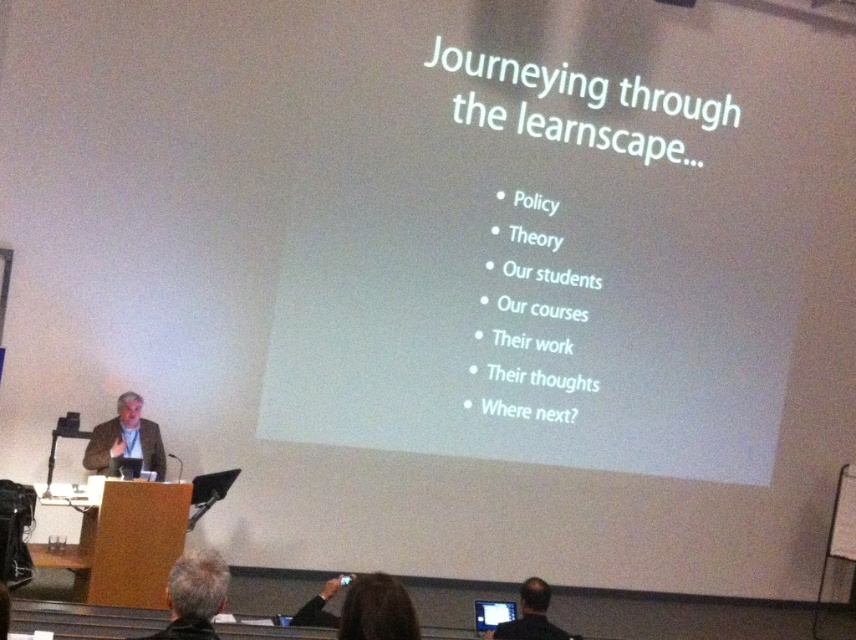
You are sitting in the front row of the lecture hall and see two points on the screen during the presentation. Which point, point [379,611] or point [214,579], appears closer to you?

Point [379,611] is closer to the viewer than point [214,579].

From the picture: You are attending a presentation in the lecture hall and notice two items of clothing on the presenter. The beige fabric suit at left and the black shirt at lower right. Which clothing item is taller?

The beige fabric suit at left is taller than the black shirt at lower right.